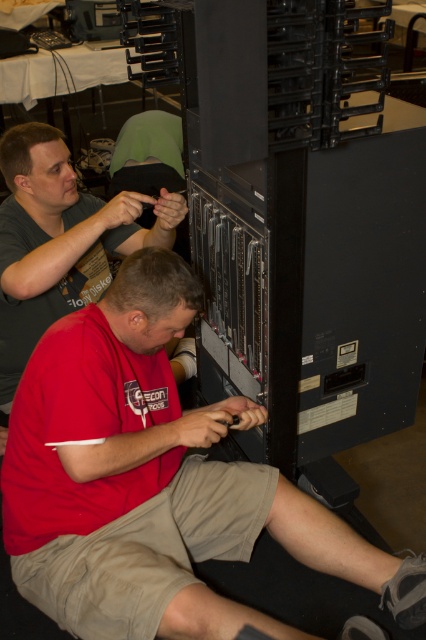
Consider the image. Who is positioned more to the right, red matte shirt at lower left or matte black shirt at upper left?

red matte shirt at lower left is more to the right.

Locate an element on the screen. The height and width of the screenshot is (640, 426). red matte shirt at lower left is located at coordinates (152, 481).